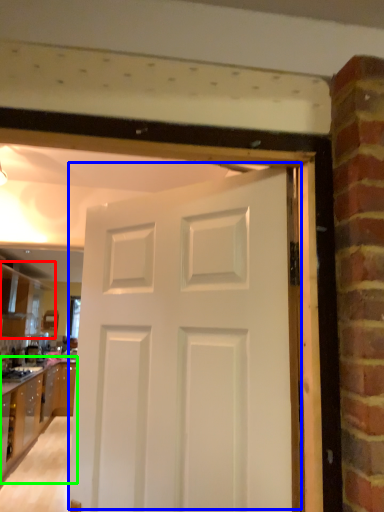
Question: Considering the real-world distances, which object is farthest from cabinetry (highlighted by a red box)? door (highlighted by a blue box) or cabinetry (highlighted by a green box)?

Choices:
 (A) door
 (B) cabinetry

Answer: (A)